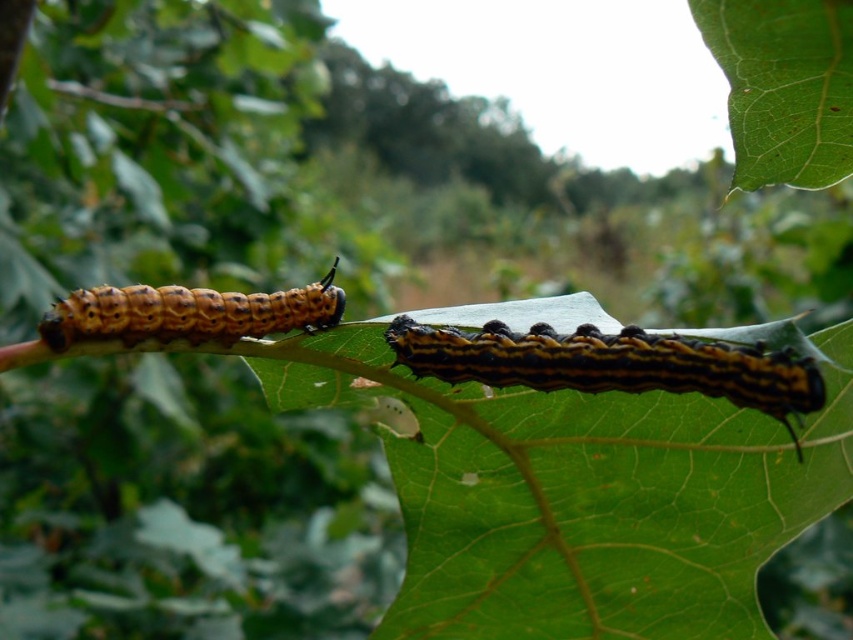
Question: From the image, what is the correct spatial relationship of brown fuzzy caterpillar at center in relation to brown fuzzy caterpillar at left?

Choices:
 (A) below
 (B) above

Answer: (A)

Question: Which point is closer to the camera?

Choices:
 (A) brown fuzzy caterpillar at center
 (B) brown fuzzy caterpillar at left

Answer: (A)

Question: Which point appears farthest from the camera in this image?

Choices:
 (A) (294, 296)
 (B) (514, 380)

Answer: (A)

Question: Which point is farther to the camera?

Choices:
 (A) brown fuzzy caterpillar at center
 (B) brown fuzzy caterpillar at left

Answer: (B)

Question: Is brown fuzzy caterpillar at center to the right of brown fuzzy caterpillar at left from the viewer's perspective?

Choices:
 (A) no
 (B) yes

Answer: (B)

Question: In this image, where is brown fuzzy caterpillar at center located relative to brown fuzzy caterpillar at left?

Choices:
 (A) left
 (B) right

Answer: (B)